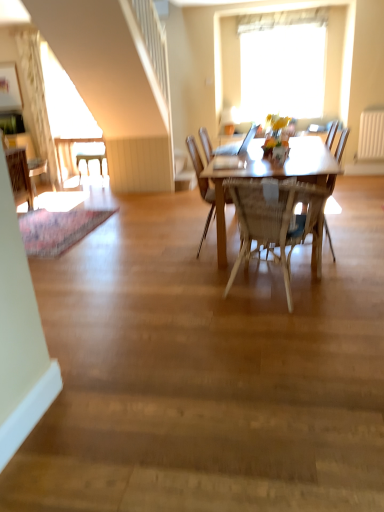
Locate an element on the screen. free spot below woven wood chair at center, marked as the 5th chair in a back-to-front arrangement (from a real-world perspective) is located at coordinates (291, 288).